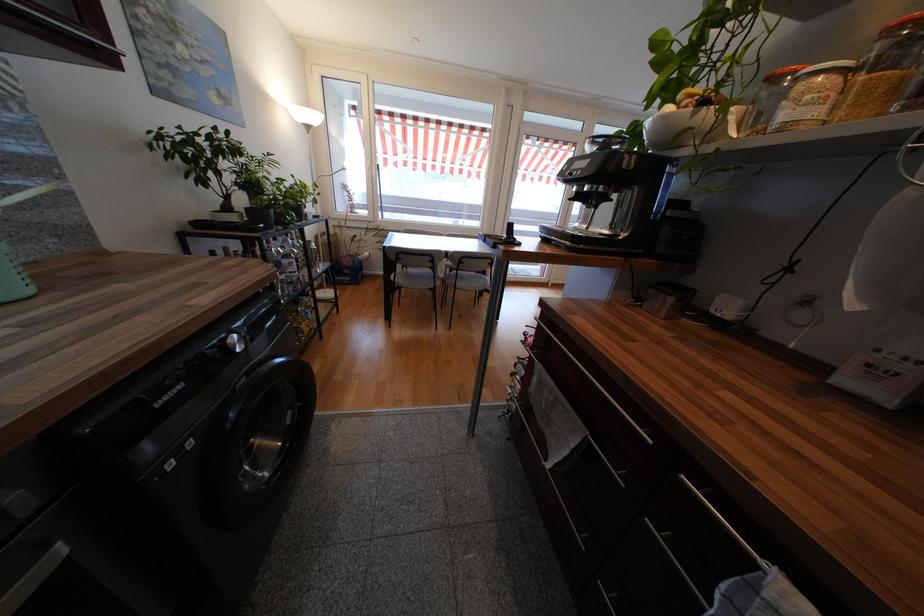
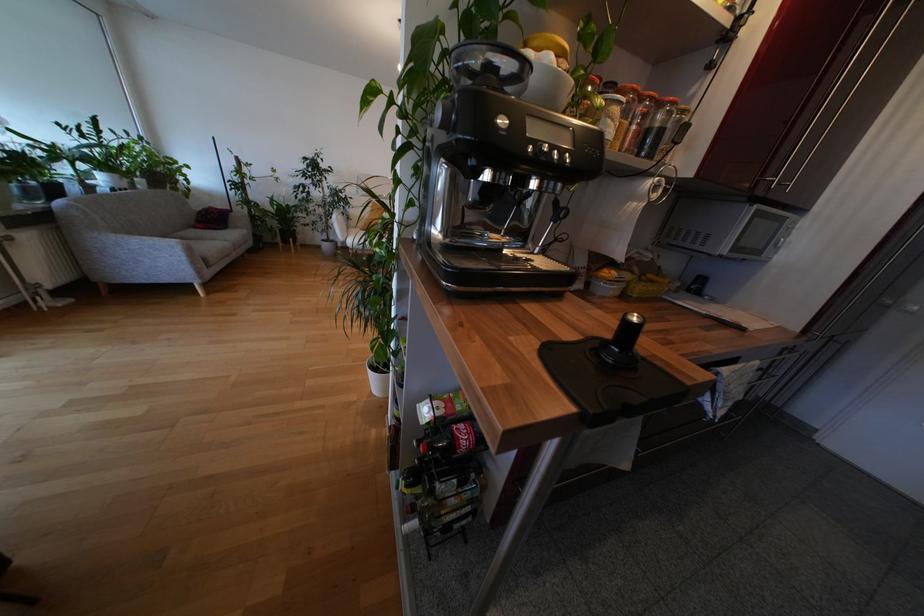
The point at (x=584, y=174) is marked in the first image. Where is the corresponding point in the second image?

(573, 159)